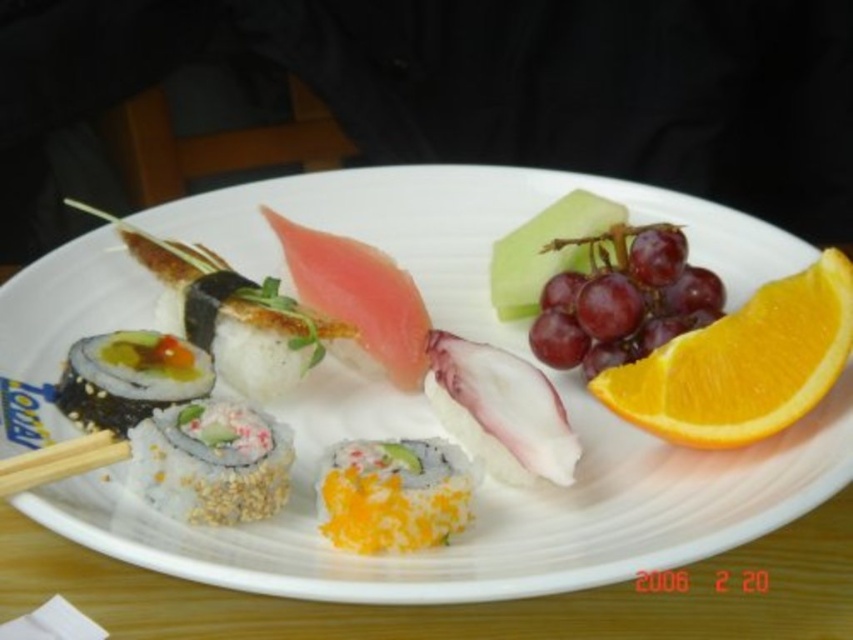
Question: Among these objects, which one is nearest to the camera?

Choices:
 (A) pink raw fish at center
 (B) wooden chopsticks at lower left
 (C) white sesame sushi at center

Answer: (B)

Question: Does white glossy plate at center have a lesser width compared to shiny purple grapes at upper right?

Choices:
 (A) yes
 (B) no

Answer: (B)

Question: Which is nearer to the shiny green seaweed at left?

Choices:
 (A) yellow rice at center
 (B) white sesame sushi at center
 (C) pink raw fish at center
 (D) orangejuicy fleshorange slice at right

Answer: (B)

Question: Is white sesame sushi at center above shiny green seaweed at left?

Choices:
 (A) no
 (B) yes

Answer: (A)

Question: Which object is closer to the camera taking this photo?

Choices:
 (A) white glossy plate at center
 (B) wooden chopsticks at lower left
 (C) shiny purple grapes at upper right
 (D) orangejuicy fleshorange slice at right

Answer: (A)

Question: Can you confirm if yellow rice at center is wider than sushi at center?

Choices:
 (A) yes
 (B) no

Answer: (B)